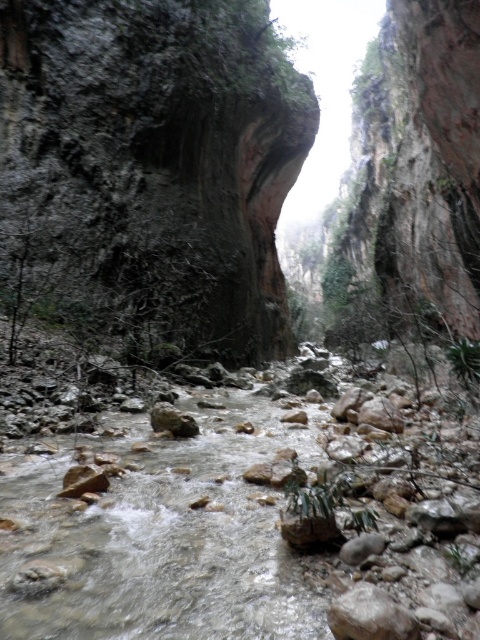
Question: Which point appears closest to the camera in this image?

Choices:
 (A) (85, 307)
 (B) (180, 422)
 (C) (88, 541)

Answer: (C)

Question: In this image, where is dark gray rock face at upper center located relative to smooth gray rock at center?

Choices:
 (A) left
 (B) right

Answer: (A)

Question: Does dark gray rock face at upper center have a larger size compared to smooth gray rock at center?

Choices:
 (A) no
 (B) yes

Answer: (B)

Question: Can you confirm if white rocky stream at center is positioned to the left of smooth gray rock at center?

Choices:
 (A) no
 (B) yes

Answer: (A)

Question: Which point appears farthest from the camera in this image?

Choices:
 (A) (158, 112)
 (B) (170, 432)
 (C) (248, 577)

Answer: (A)

Question: Which point is closer to the camera taking this photo?

Choices:
 (A) (140, 516)
 (B) (168, 413)
 (C) (26, 202)

Answer: (A)